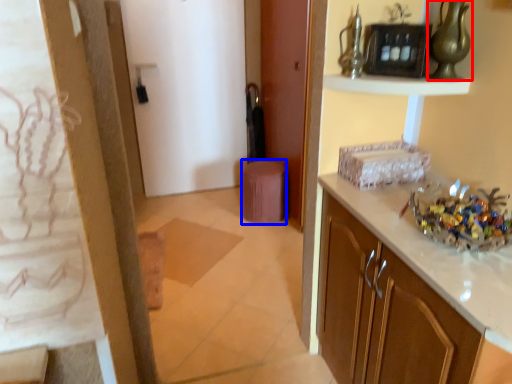
Question: Which of the following is the farthest to the observer, glass vase (highlighted by a red box) or stool (highlighted by a blue box)?

Choices:
 (A) glass vase
 (B) stool

Answer: (B)